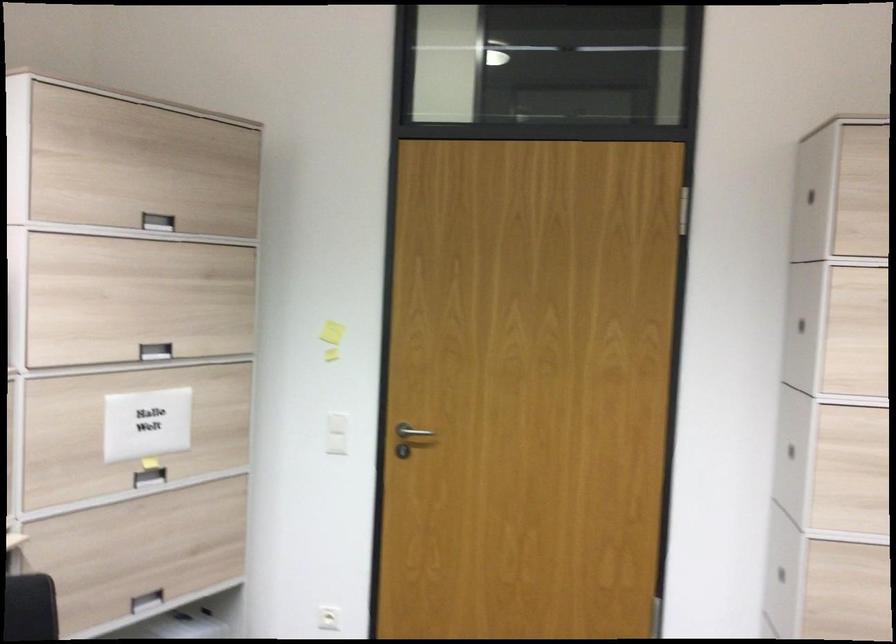
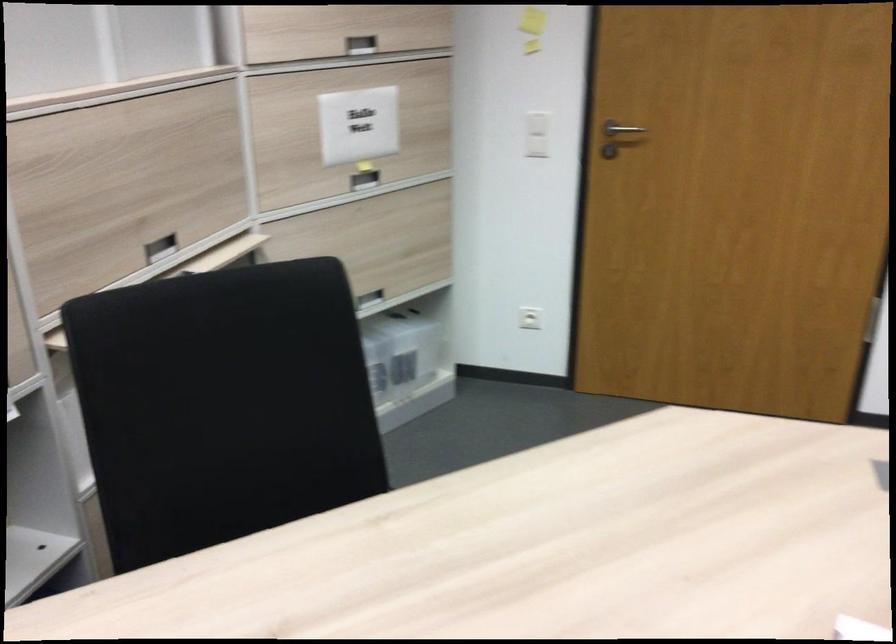
Where in the second image is the point corresponding to pixel 411 433 from the first image?

(619, 129)